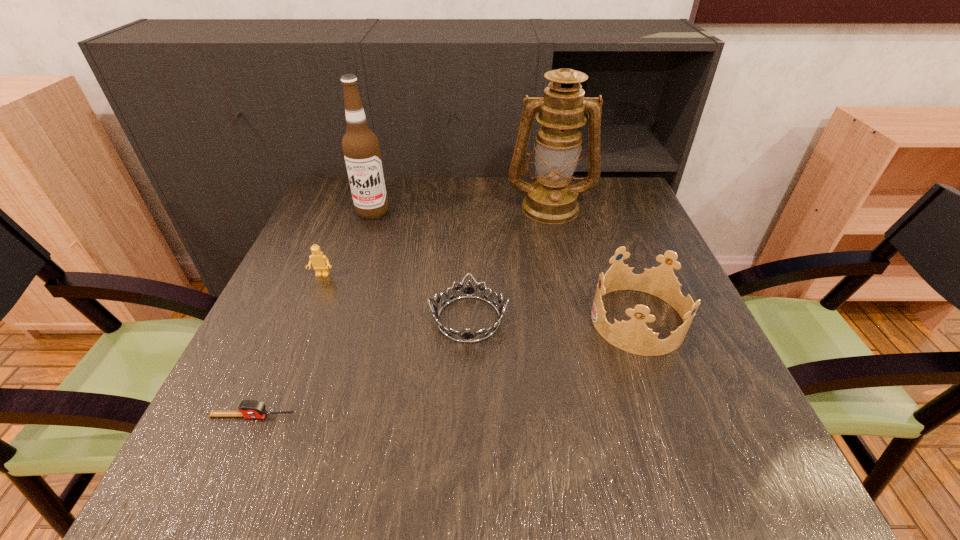
In order to click on alcohol at the left edge in this screenshot , I will do `click(361, 149)`.

You are a GUI agent. You are given a task and a screenshot of the screen. Output one action in this format:
    pyautogui.click(x=<x>, y=<y>)
    Task: Click on the Lego present at the left edge
    
    Given the screenshot: What is the action you would take?
    pyautogui.click(x=319, y=261)

Where is `tape measure present at the left edge`? The image size is (960, 540). tape measure present at the left edge is located at coordinates (249, 409).

Where is `oil lamp that is at the right edge`? oil lamp that is at the right edge is located at coordinates (551, 199).

The width and height of the screenshot is (960, 540). I want to click on tiara at the right edge, so click(633, 336).

Identify the location of object present at the far left corner. (361, 149).

Locate an element on the screen. The width and height of the screenshot is (960, 540). object that is at the far right corner is located at coordinates (551, 199).

Locate an element on the screen. vacant space at the far edge of the desktop is located at coordinates (467, 214).

Where is `blank space at the near edge of the desktop`? blank space at the near edge of the desktop is located at coordinates (518, 483).

Identify the location of free spot at the left edge of the desktop. (312, 242).